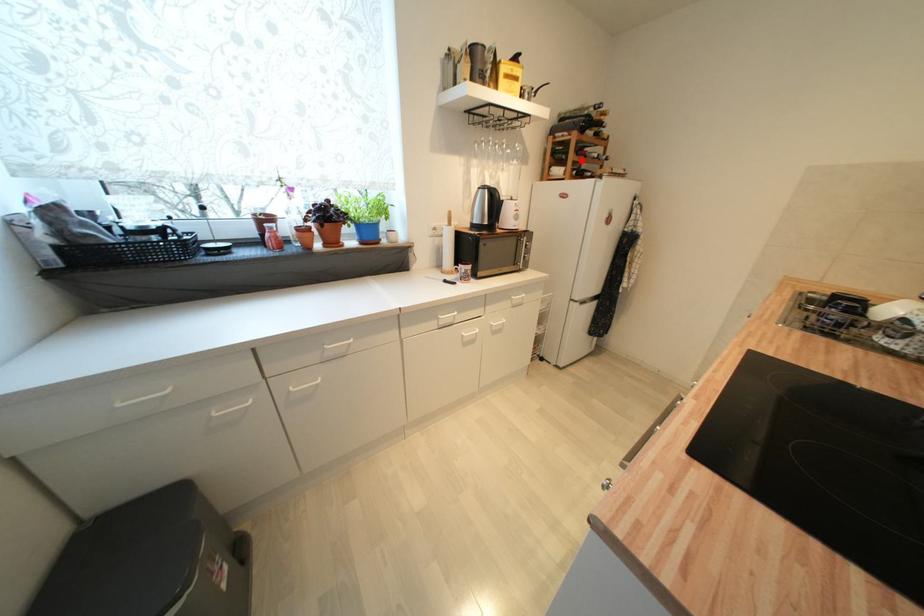
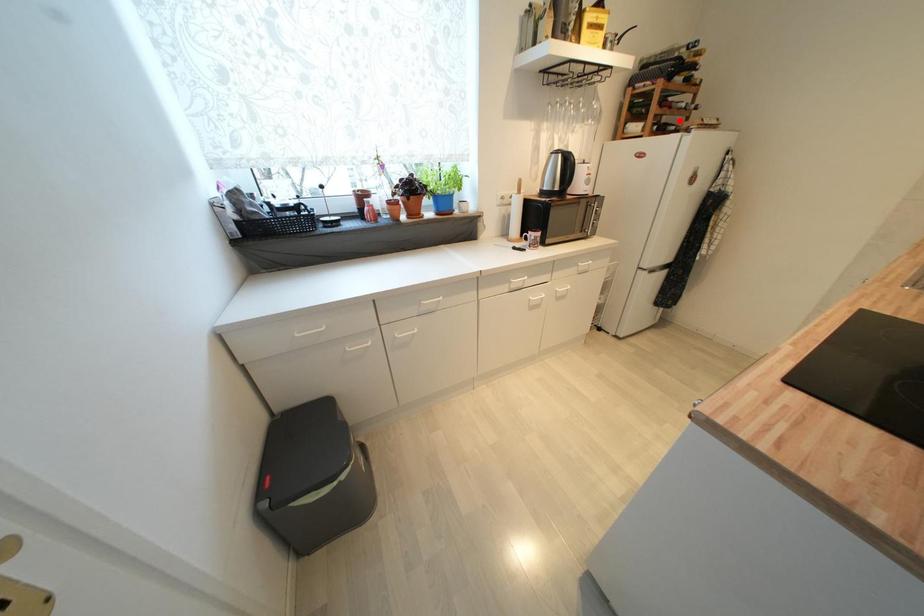
I am providing you with two images of the same scene from different viewpoints. A red point is marked on the first image and another point is marked on the second image. Is the marked point in image1 the same physical position as the marked point in image2?

No